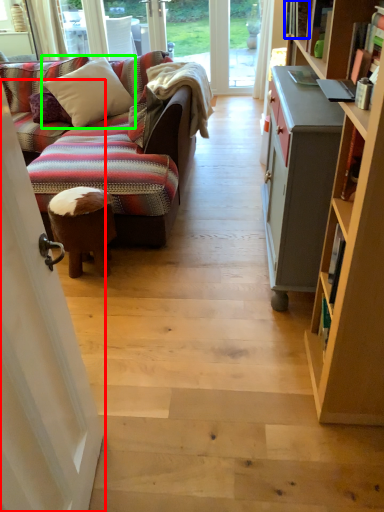
Question: Which object is the closest to the screen door (highlighted by a red box)? Choose among these: book (highlighted by a blue box) or pillow (highlighted by a green box).

Choices:
 (A) book
 (B) pillow

Answer: (A)